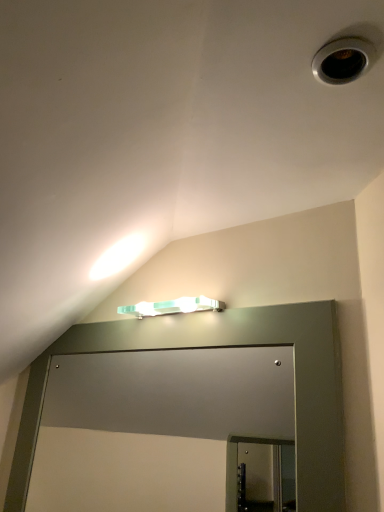
Question: Which direction should I rotate to look at mint green plastic light fixture at upper center?

Choices:
 (A) left
 (B) right

Answer: (A)

Question: Is the surface of mint green plastic light fixture at upper center in direct contact with matte gray glass door at center?

Choices:
 (A) yes
 (B) no

Answer: (B)

Question: Is mint green plastic light fixture at upper center to the right of matte gray glass door at center from the viewer's perspective?

Choices:
 (A) no
 (B) yes

Answer: (B)

Question: Is matte gray glass door at center a part of mint green plastic light fixture at upper center?

Choices:
 (A) no
 (B) yes

Answer: (A)

Question: Does mint green plastic light fixture at upper center appear on the left side of matte gray glass door at center?

Choices:
 (A) no
 (B) yes

Answer: (A)

Question: Is mint green plastic light fixture at upper center bigger than matte gray glass door at center?

Choices:
 (A) no
 (B) yes

Answer: (A)

Question: Considering the relative positions of mint green plastic light fixture at upper center and matte gray glass door at center in the image provided, is mint green plastic light fixture at upper center in front of matte gray glass door at center?

Choices:
 (A) no
 (B) yes

Answer: (A)

Question: Is matte gray glass door at center wider than mint green plastic light fixture at upper center?

Choices:
 (A) yes
 (B) no

Answer: (B)

Question: Is matte gray glass door at center smaller than mint green plastic light fixture at upper center?

Choices:
 (A) no
 (B) yes

Answer: (A)

Question: Is matte gray glass door at center at the right side of mint green plastic light fixture at upper center?

Choices:
 (A) no
 (B) yes

Answer: (A)

Question: From a real-world perspective, is matte gray glass door at center on top of mint green plastic light fixture at upper center?

Choices:
 (A) yes
 (B) no

Answer: (B)

Question: Is the position of matte gray glass door at center more distant than that of mint green plastic light fixture at upper center?

Choices:
 (A) no
 (B) yes

Answer: (A)

Question: Does matte gray glass door at center have a greater height compared to mint green plastic light fixture at upper center?

Choices:
 (A) yes
 (B) no

Answer: (A)

Question: From a real-world perspective, is matte gray glass door at center positioned above or below mint green plastic light fixture at upper center?

Choices:
 (A) above
 (B) below

Answer: (B)